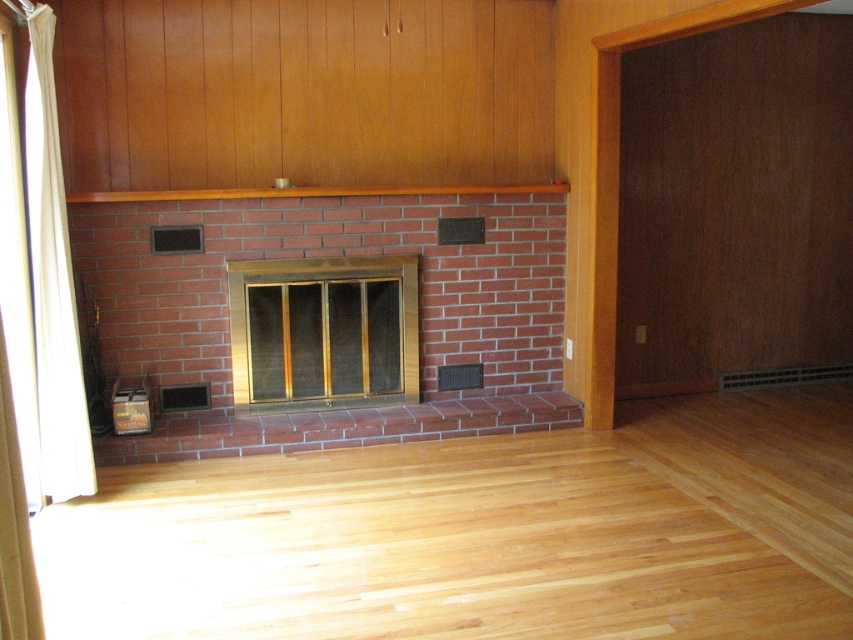
Question: Can you confirm if white fabric curtain at left is bigger than brown wood mantle at upper center?

Choices:
 (A) no
 (B) yes

Answer: (A)

Question: Is white fabric curtain at left positioned before brown wood mantle at upper center?

Choices:
 (A) yes
 (B) no

Answer: (A)

Question: Which point is closer to the camera?

Choices:
 (A) (274, 252)
 (B) (49, 456)

Answer: (B)

Question: Which object is the farthest from the red brick fireplace at center?

Choices:
 (A) brown wood mantle at upper center
 (B) white fabric curtain at left

Answer: (B)

Question: Which point is closer to the camera?

Choices:
 (A) brown wood mantle at upper center
 (B) white fabric curtain at left

Answer: (B)

Question: Is white fabric curtain at left positioned behind brown wood mantle at upper center?

Choices:
 (A) yes
 (B) no

Answer: (B)